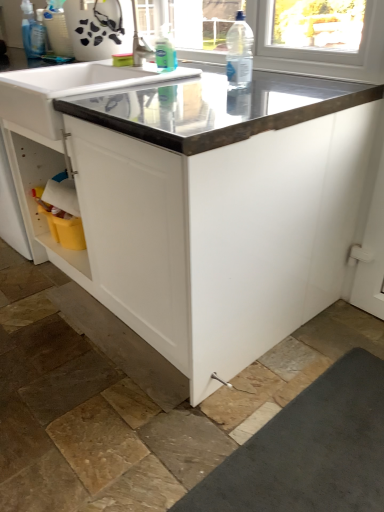
You are a GUI agent. You are given a task and a screenshot of the screen. Output one action in this format:
    pyautogui.click(x=<x>, y=<y>)
    Task: Click on the free area behind clear plastic bottle at upper center
    Image resolution: width=384 pixels, height=512 pixels.
    Given the screenshot: What is the action you would take?
    pyautogui.click(x=213, y=79)